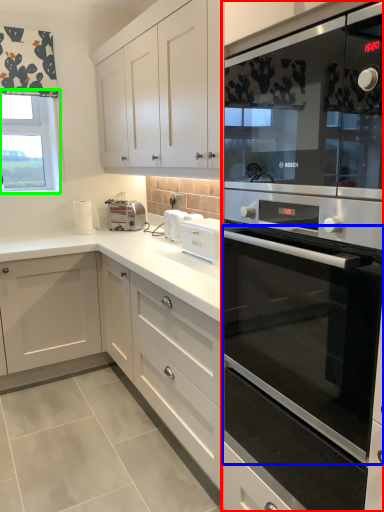
Question: Which is nearer to the home appliance (highlighted by a red box)? oven (highlighted by a blue box) or window (highlighted by a green box).

Choices:
 (A) oven
 (B) window

Answer: (A)